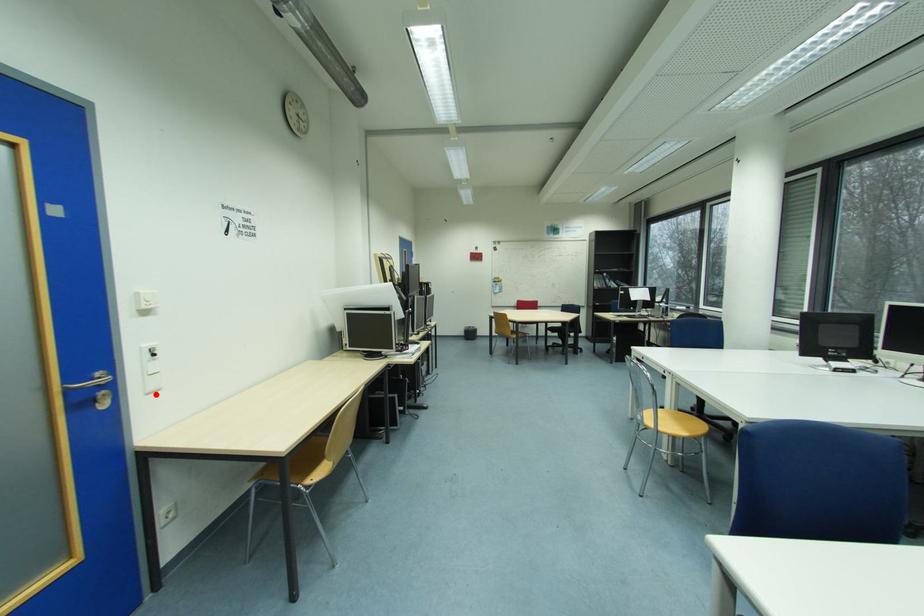
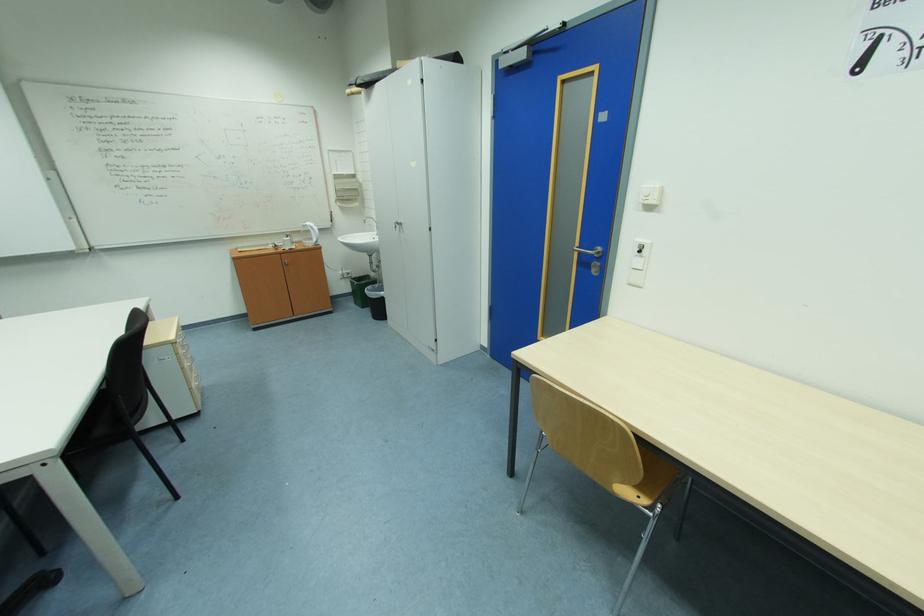
Question: I am providing you with two images of the same scene from different viewpoints. A red point is marked on the first image. Can you still see the location of the red point in image 2?

Choices:
 (A) Yes
 (B) No

Answer: (A)